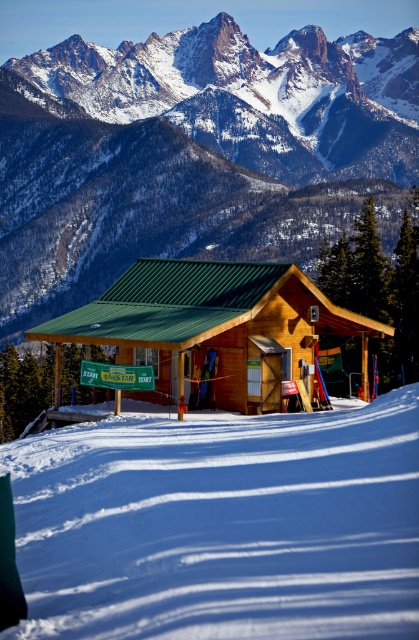
Question: Does snowy rock at upper center appear on the right side of white snow at center?

Choices:
 (A) no
 (B) yes

Answer: (A)

Question: Which point is closer to the camera?

Choices:
 (A) (369, 120)
 (B) (240, 396)
 (C) (72, 465)

Answer: (C)

Question: Is snowy rock at upper center to the left of wooden cabin at center from the viewer's perspective?

Choices:
 (A) yes
 (B) no

Answer: (A)

Question: Considering the relative positions of white snow at center and wooden cabin at center in the image provided, where is white snow at center located with respect to wooden cabin at center?

Choices:
 (A) below
 (B) above

Answer: (A)

Question: Estimate the real-world distances between objects in this image. Which object is farther from the snowy rock at upper center?

Choices:
 (A) wooden cabin at center
 (B) white snow at center

Answer: (B)

Question: Which point is farther to the camera?

Choices:
 (A) (193, 227)
 (B) (212, 324)
 (C) (364, 490)

Answer: (A)